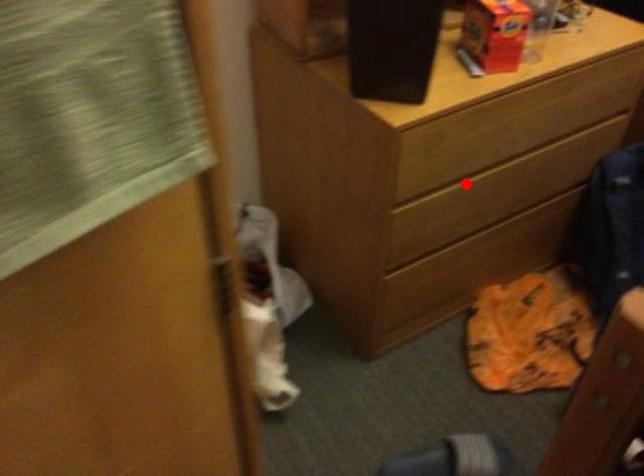
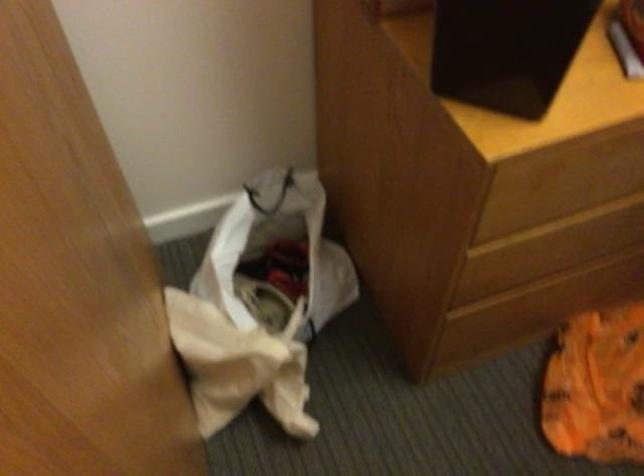
Question: I am providing you with two images of the same scene from different viewpoints. Given a red point in image1, look at the same physical point in image2. Is it:

Choices:
 (A) Closer to the viewpoint
 (B) Farther from the viewpoint

Answer: (A)